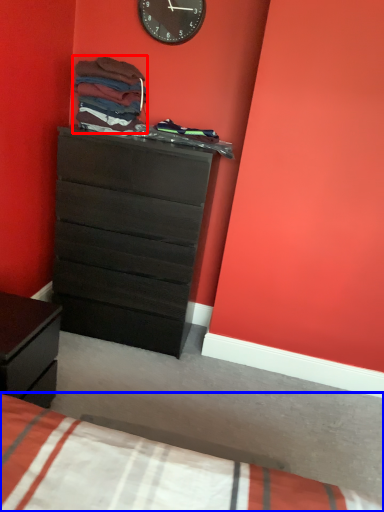
Question: Which object is closer to the camera taking this photo, clothing (highlighted by a red box) or bed (highlighted by a blue box)?

Choices:
 (A) clothing
 (B) bed

Answer: (B)